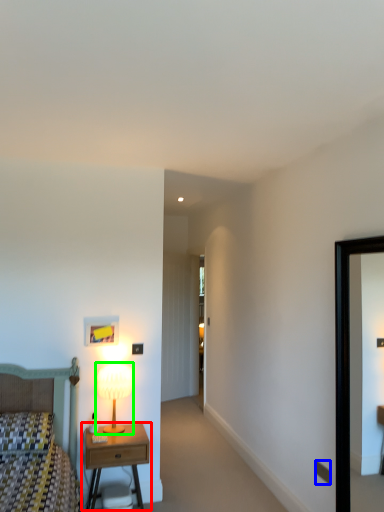
Question: Estimate the real-world distances between objects in this image. Which object is farther from nightstand (highlighted by a red box), electric outlet (highlighted by a blue box) or table lamp (highlighted by a green box)?

Choices:
 (A) electric outlet
 (B) table lamp

Answer: (A)